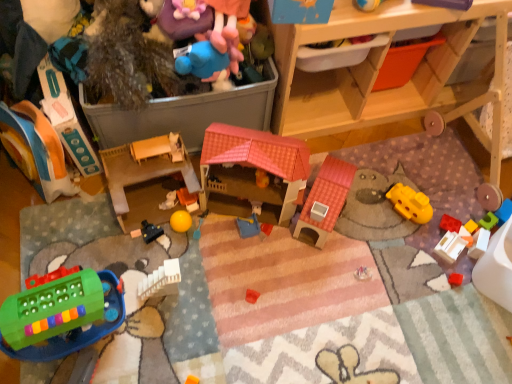
This screenshot has height=384, width=512. I want to click on vacant space that is in between white matte block at lower right, positioned as the second toy in right-to-left order, and smooth orange ball at center, positioned as the 7th toy in left-to-right order, so click(345, 230).